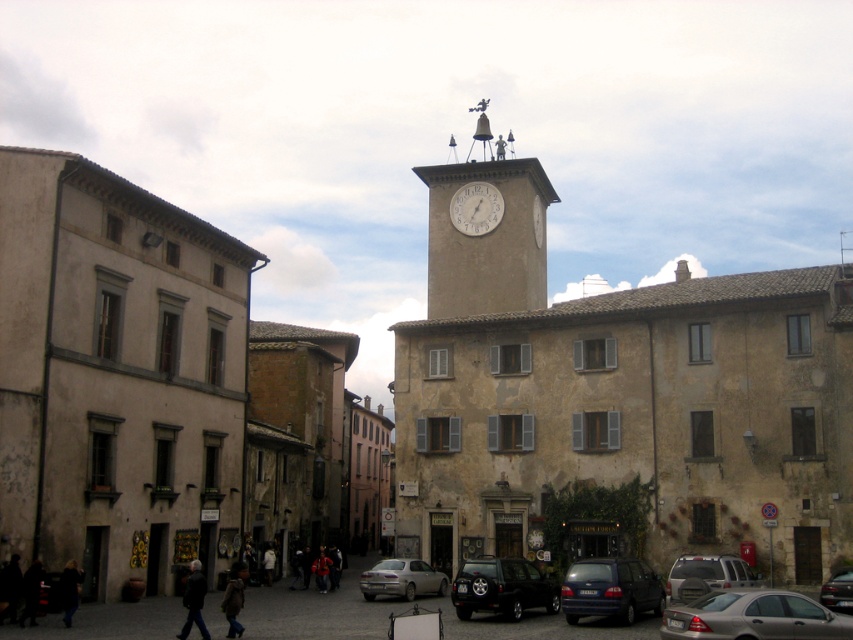
Does white matte clock at upper center appear over shiny black car at lower right?

Correct, white matte clock at upper center is located above shiny black car at lower right.

Who is taller, white matte clock at upper center or shiny black car at lower right?

Standing taller between the two is shiny black car at lower right.

Is point (485, 224) positioned in front of point (834, 592)?

No.

The width and height of the screenshot is (853, 640). Find the location of `white matte clock at upper center`. white matte clock at upper center is located at coordinates (474, 209).

Is matte silver sedan at center taller than matte blue van at center?

Yes.

Is matte silver sedan at center to the right of matte blue van at center from the viewer's perspective?

Indeed, matte silver sedan at center is positioned on the right side of matte blue van at center.

Between point (802, 595) and point (616, 579), which one is positioned behind?

Point (802, 595)

Where is `matte silver sedan at center`? matte silver sedan at center is located at coordinates (753, 618).

Does matte silver sedan at center have a smaller size compared to white matte clock at upper center?

No, matte silver sedan at center is not smaller than white matte clock at upper center.

Between point (720, 608) and point (480, 202), which one is positioned in front?

Point (720, 608) is more forward.

The image size is (853, 640). I want to click on matte silver sedan at center, so coord(753,618).